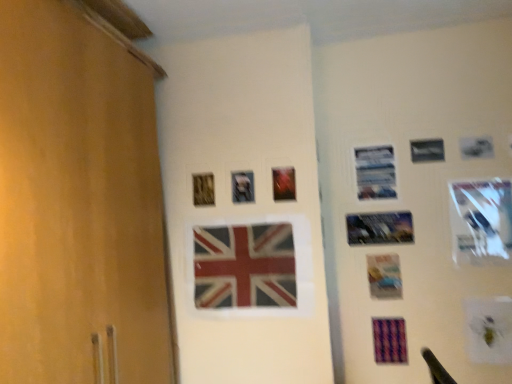
Question: Is metallic silver picture frame at center, positioned as the sixth picture frame in right-to-left order, placed right next to wooden picture frame at upper center, which ranks as the seventh picture frame in right-to-left order?

Choices:
 (A) no
 (B) yes

Answer: (A)

Question: Is metallic silver picture frame at center, placed as the 2th picture frame when sorted from left to right, at the right side of wooden picture frame at upper center, which ranks as the seventh picture frame in right-to-left order?

Choices:
 (A) yes
 (B) no

Answer: (A)

Question: From the image's perspective, is metallic silver picture frame at center, positioned as the sixth picture frame in right-to-left order, below wooden picture frame at upper center, which ranks as the seventh picture frame in right-to-left order?

Choices:
 (A) yes
 (B) no

Answer: (B)

Question: Is metallic silver picture frame at center, placed as the 2th picture frame when sorted from left to right, positioned behind wooden picture frame at upper center, positioned as the 1th picture frame in left-to-right order?

Choices:
 (A) no
 (B) yes

Answer: (A)

Question: From a real-world perspective, is metallic silver picture frame at center, positioned as the sixth picture frame in right-to-left order, positioned under wooden picture frame at upper center, positioned as the 1th picture frame in left-to-right order, based on gravity?

Choices:
 (A) yes
 (B) no

Answer: (A)

Question: From a real-world perspective, is metallic reflective photo frame at upper center, the third picture frame when ordered from left to right, physically located above or below matte plastic flag at center?

Choices:
 (A) below
 (B) above

Answer: (B)

Question: Is metallic reflective photo frame at upper center, arranged as the fifth picture frame when viewed from the right, bigger or smaller than matte plastic flag at center?

Choices:
 (A) big
 (B) small

Answer: (B)

Question: Is metallic reflective photo frame at upper center, arranged as the fifth picture frame when viewed from the right, spatially inside matte plastic flag at center, or outside of it?

Choices:
 (A) outside
 (B) inside

Answer: (A)

Question: In the image, is metallic reflective photo frame at upper center, the third picture frame when ordered from left to right, positioned in front of or behind matte plastic flag at center?

Choices:
 (A) behind
 (B) front

Answer: (A)

Question: Is wooden picture frame at upper center, positioned as the 1th picture frame in left-to-right order, spatially inside metallic reflective photo frame at center-right, which ranks as the third picture frame in right-to-left order, or outside of it?

Choices:
 (A) inside
 (B) outside

Answer: (B)

Question: Is point (208, 175) closer or farther from the camera than point (410, 213)?

Choices:
 (A) farther
 (B) closer

Answer: (B)

Question: Considering the positions of wooden picture frame at upper center, which ranks as the seventh picture frame in right-to-left order, and metallic reflective photo frame at center-right, acting as the 5th picture frame starting from the left, in the image, is wooden picture frame at upper center, which ranks as the seventh picture frame in right-to-left order, bigger or smaller than metallic reflective photo frame at center-right, acting as the 5th picture frame starting from the left,?

Choices:
 (A) small
 (B) big

Answer: (A)

Question: In terms of width, does wooden picture frame at upper center, which ranks as the seventh picture frame in right-to-left order, look wider or thinner when compared to metallic reflective photo frame at center-right, which ranks as the third picture frame in right-to-left order?

Choices:
 (A) wide
 (B) thin

Answer: (A)

Question: In the image, is metallic reflective photo frame at center-right, acting as the 5th picture frame starting from the left, positioned in front of or behind metallic silver picture frame at upper right, marked as the 4th picture frame in a right-to-left arrangement?

Choices:
 (A) behind
 (B) front

Answer: (B)

Question: From a real-world perspective, is metallic reflective photo frame at center-right, which ranks as the third picture frame in right-to-left order, above or below metallic silver picture frame at upper right, positioned as the fourth picture frame in left-to-right order?

Choices:
 (A) below
 (B) above

Answer: (A)